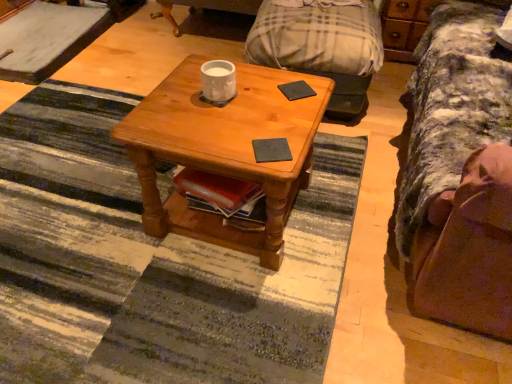
Question: From the image's perspective, is wooden coffee table at center positioned above or below wooden dresser at upper right?

Choices:
 (A) below
 (B) above

Answer: (A)

Question: In terms of width, does wooden coffee table at center look wider or thinner when compared to wooden dresser at upper right?

Choices:
 (A) wide
 (B) thin

Answer: (A)

Question: Estimate the real-world distances between objects in this image. Which object is farther from the black matte pad at center, the second pad from the bottom?

Choices:
 (A) brown fabric couch at right
 (B) black matte pad at center, which ranks as the second pad in top-to-bottom order
 (C) wooden dresser at upper right
 (D) white glossy mug at center
 (E) wooden coffee table at center

Answer: (C)

Question: Considering the real-world distances, which object is closest to the black matte pad at center, the 1th pad in the back-to-front sequence?

Choices:
 (A) wooden dresser at upper right
 (B) white glossy mug at center
 (C) black matte pad at center, arranged as the 1th pad when viewed from the front
 (D) wooden coffee table at center
 (E) brown fabric couch at right

Answer: (B)